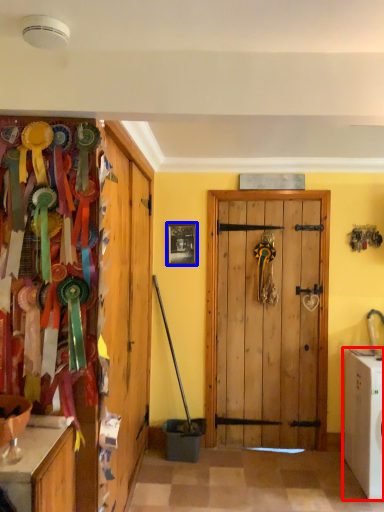
Question: Which point is further to the camera, washing machine (highlighted by a red box) or picture frame (highlighted by a blue box)?

Choices:
 (A) washing machine
 (B) picture frame

Answer: (B)